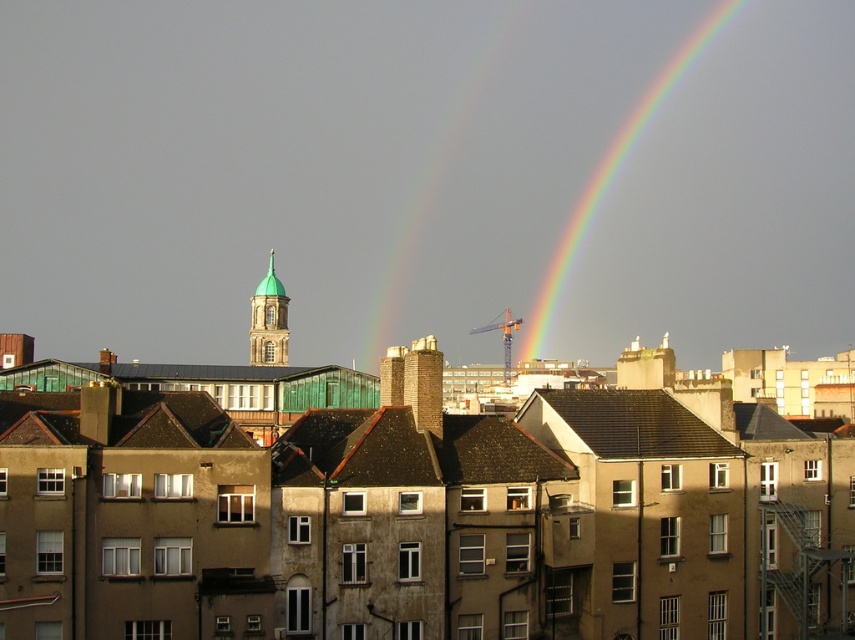
Question: Among these objects, which one is farthest from the camera?

Choices:
 (A) rainbow at upper center
 (B) green copper dome at center

Answer: (A)

Question: In this image, where is rainbow at upper center located relative to brick chimney at center?

Choices:
 (A) below
 (B) above

Answer: (B)

Question: Does brick chimney at center have a smaller size compared to green copper dome at center?

Choices:
 (A) no
 (B) yes

Answer: (B)

Question: Among these objects, which one is nearest to the camera?

Choices:
 (A) green copper dome at center
 (B) brick chimney at center
 (C) rainbow at upper center

Answer: (B)

Question: Is brick chimney at center thinner than green copper dome at center?

Choices:
 (A) yes
 (B) no

Answer: (A)

Question: Estimate the real-world distances between objects in this image. Which object is farther from the brick chimney at center?

Choices:
 (A) rainbow at upper center
 (B) green copper dome at center

Answer: (A)